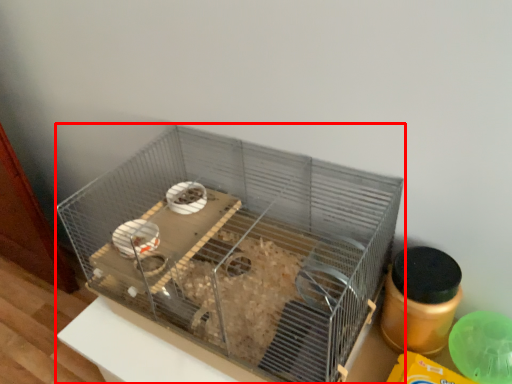
Question: From the image, what is the correct spatial relationship of bird cage (annotated by the red box) in relation to bottle?

Choices:
 (A) right
 (B) left

Answer: (B)